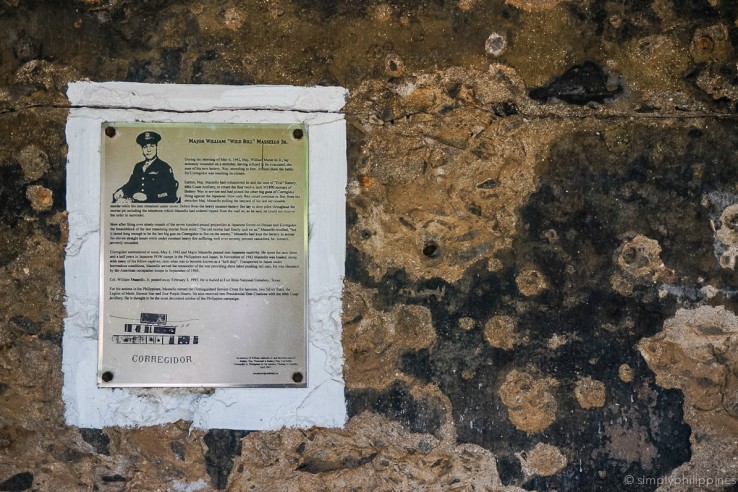
I want to click on left edge of the poster, so click(80, 264).